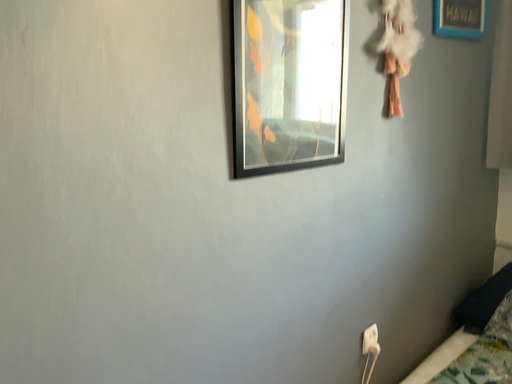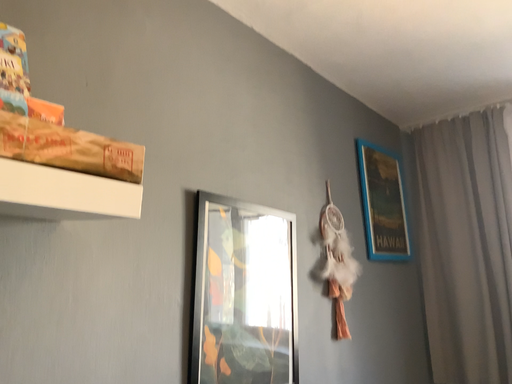
Question: Which way did the camera rotate in the video?

Choices:
 (A) rotated left
 (B) rotated right

Answer: (B)